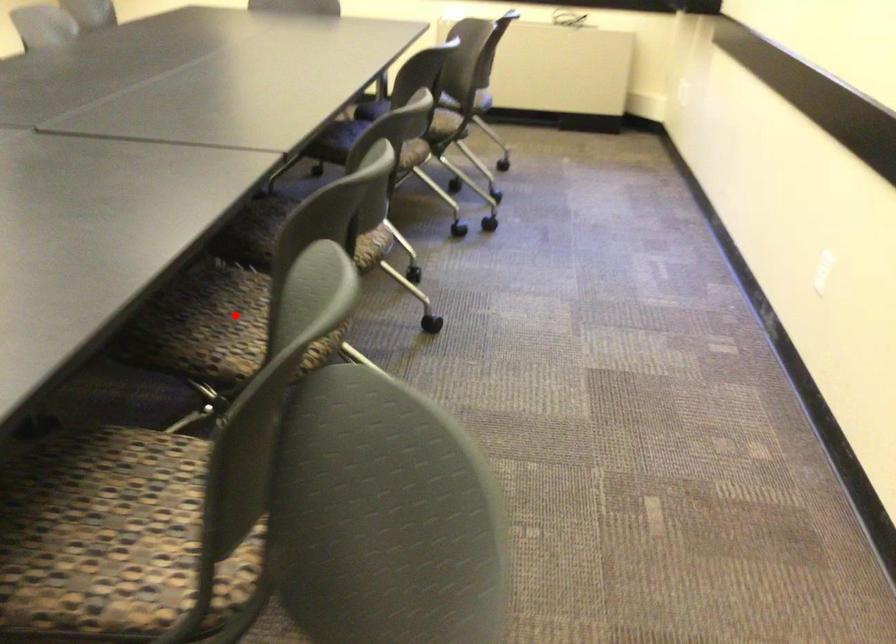
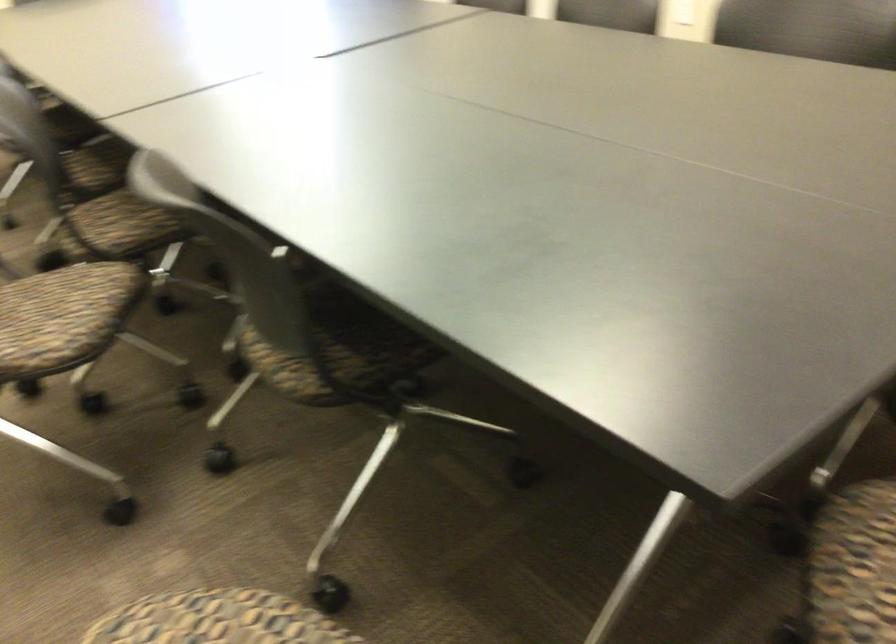
Question: I am providing you with two images of the same scene from different viewpoints. A red point is marked on the first image. Is the red point's position out of view in image 2?

Choices:
 (A) Yes
 (B) No

Answer: (A)